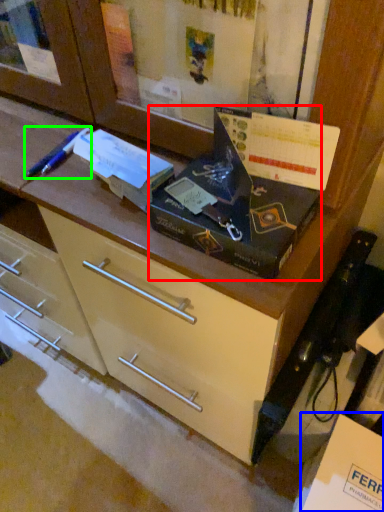
Question: Considering the real-world distances, which object is farthest from box (highlighted by a red box)? cardboard box (highlighted by a blue box) or penguin (highlighted by a green box)?

Choices:
 (A) cardboard box
 (B) penguin

Answer: (A)